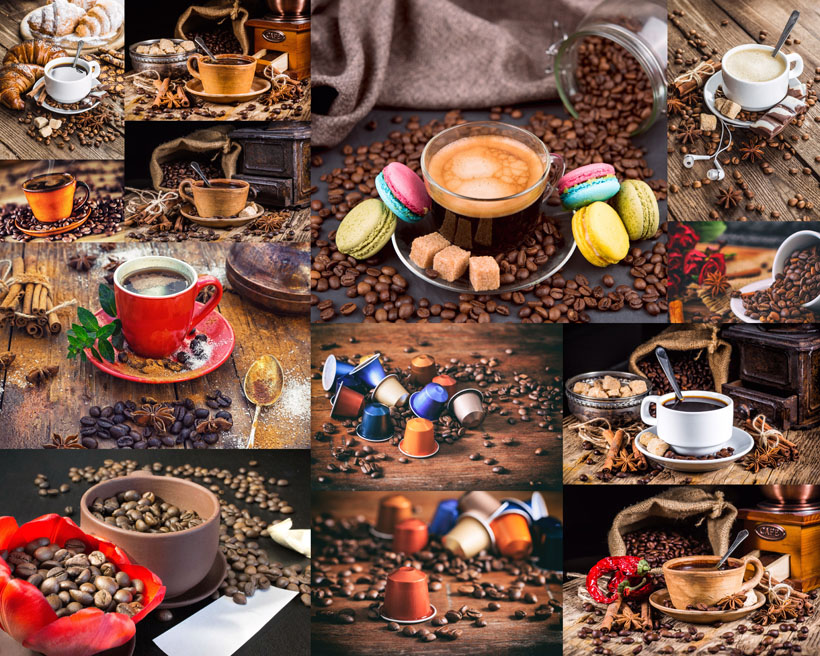
The width and height of the screenshot is (820, 656). Find the location of `small blue cups in small photo in middle`. small blue cups in small photo in middle is located at coordinates (426, 405), (372, 422), (367, 373), (342, 371).